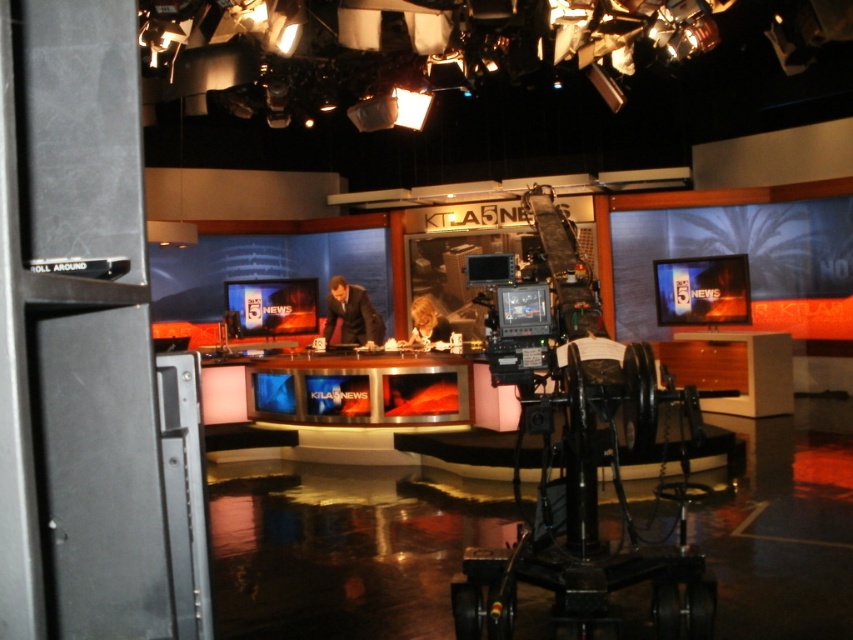
Is black matte video camera at center below dark suit at center?

Incorrect, black matte video camera at center is not positioned below dark suit at center.

Who is positioned more to the right, black matte video camera at center or dark suit at center?

From the viewer's perspective, black matte video camera at center appears more on the right side.

Between point (515, 314) and point (337, 292), which one is positioned in front?

Point (515, 314) is in front.

Where is `black matte video camera at center`? Image resolution: width=853 pixels, height=640 pixels. black matte video camera at center is located at coordinates (511, 320).